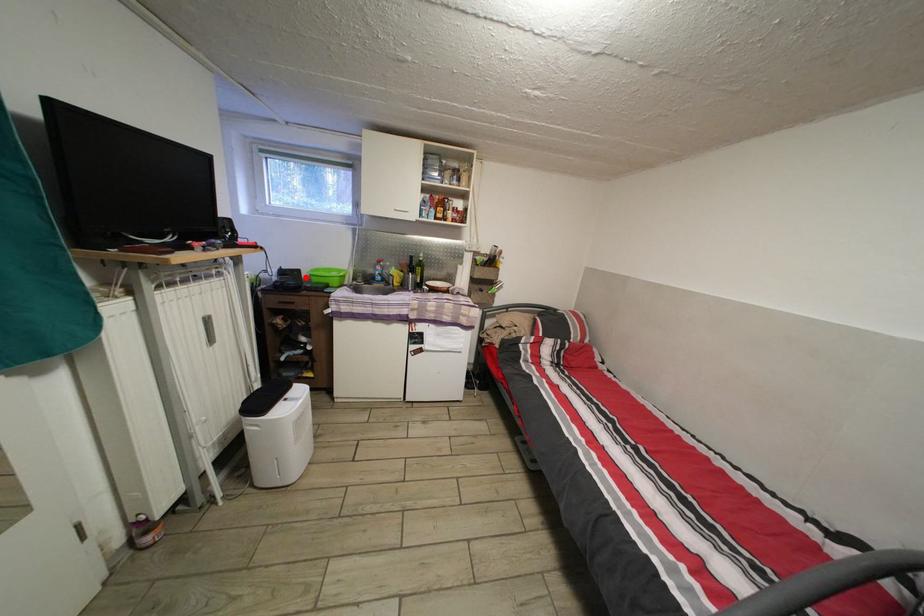
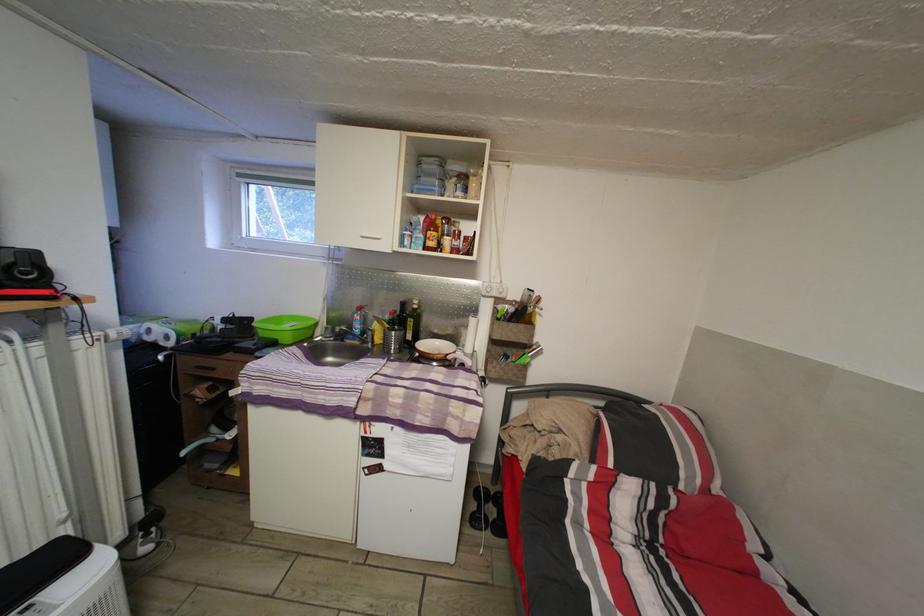
Where in the second image is the point corresponding to the highlighted location from the first image?

(257, 326)